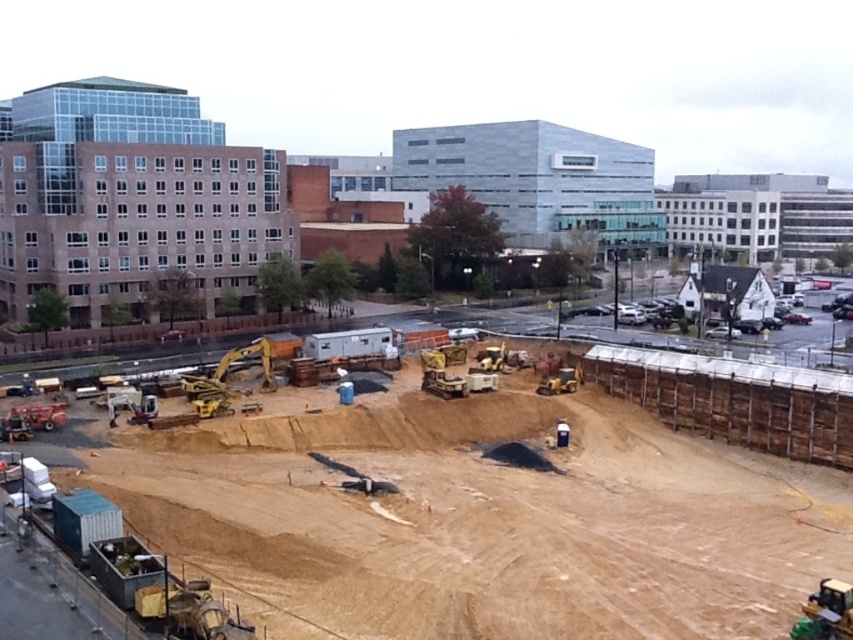
How much distance is there between brown dirt at center and yellow rubber at center?

brown dirt at center is 19.31 meters from yellow rubber at center.

Who is positioned more to the right, brown dirt at center or yellow rubber at center?

yellow rubber at center is more to the right.

You are a GUI agent. You are given a task and a screenshot of the screen. Output one action in this format:
    pyautogui.click(x=<x>, y=<y>)
    Task: Click on the brown dirt at center
    The width and height of the screenshot is (853, 640).
    Given the screenshot: What is the action you would take?
    pyautogui.click(x=473, y=516)

You are a GUI agent. You are given a task and a screenshot of the screen. Output one action in this format:
    pyautogui.click(x=<x>, y=<y>)
    Task: Click on the brown dirt at center
    
    Given the screenshot: What is the action you would take?
    pyautogui.click(x=473, y=516)

Does gray metallic building at center have a greater height compared to yellow rubber at center?

Yes, gray metallic building at center is taller than yellow rubber at center.

Between gray metallic building at center and yellow rubber at center, which one is positioned lower?

yellow rubber at center

Between point (434, 189) and point (556, 378), which one is positioned behind?

The point (434, 189) is behind.

At what (x,y) coordinates should I click in order to perform the action: click on gray metallic building at center. Please return your answer as a coordinate pair (x, y). The image size is (853, 640). Looking at the image, I should click on (537, 179).

Where is `brown dirt at center`? brown dirt at center is located at coordinates (473, 516).

Who is taller, brown dirt at center or gray metallic building at center?

Standing taller between the two is gray metallic building at center.

Is point (149, 465) positioned behind point (431, 129)?

No, it is not.

Identify the location of brown dirt at center. (473, 516).